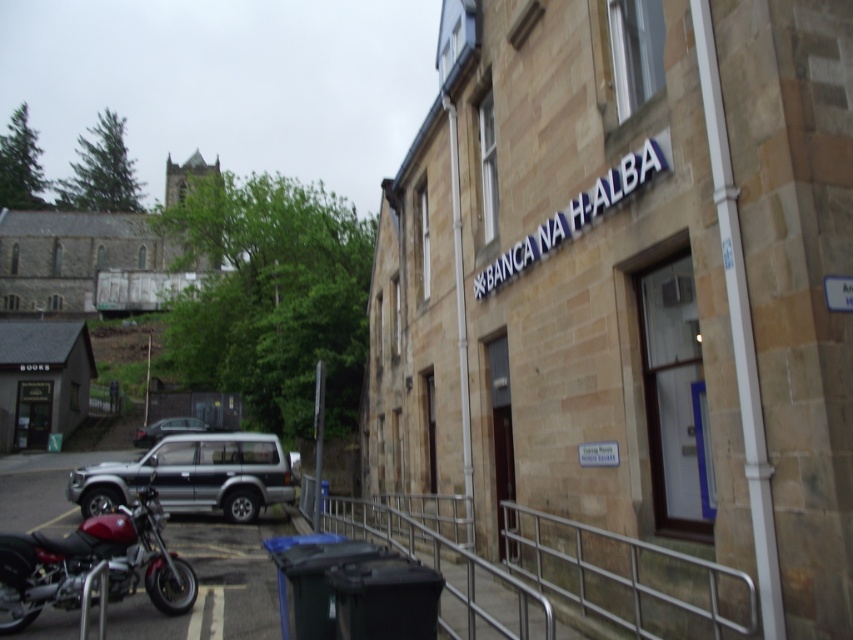
You are a delivery person approaching the building and need to park your vehicle. There is a silver metallic rail at lower center. Where should you position your vehicle relative to the rail to ensure compliance with parking regulations?

The silver metallic rail at lower center is located at point [622,577], so you should park your vehicle away from the rail to avoid blocking the accessibility features it provides.

In the scene shown: You are standing in front of the stone building with the sign BANCA NA H ALBA. There are two points marked on the ground in front of you. The first point is at coordinate point (459, 513) and the second point is at coordinate point (264, 452). Which point is closer to your current position?

Point (459, 513) is closer to the camera than point (264, 452), so the first point is closer to your current position.

You are a delivery person standing in front of the stone building with the sign. You need to park your delivery van, which is 16 feet long, as close as possible to the silver metallic rail at lower center without blocking the entrance. Is there enough space between the viewer position and the rail to park the van?

The silver metallic rail at lower center is 15.59 feet away from the viewer. Since the delivery van is 16 feet long, it is slightly longer than the available space. Therefore, the van cannot be parked there without blocking the entrance.